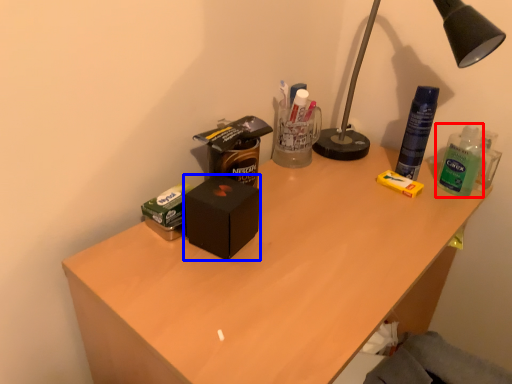
Question: Among these objects, which one is farthest to the camera, bottle (highlighted by a red box) or box (highlighted by a blue box)?

Choices:
 (A) bottle
 (B) box

Answer: (A)